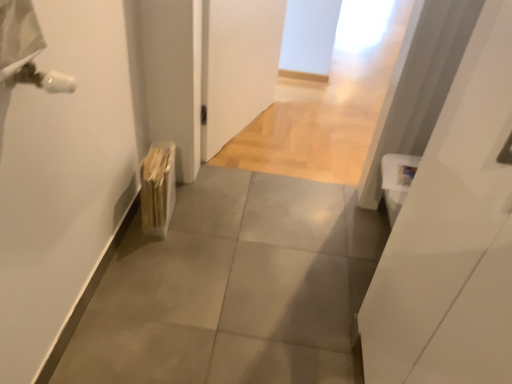
Question: Could you tell me if gray tile floor at center is turned towards wooden radiator at lower left?

Choices:
 (A) no
 (B) yes

Answer: (A)

Question: Does gray tile floor at center have a lesser width compared to wooden radiator at lower left?

Choices:
 (A) yes
 (B) no

Answer: (B)

Question: Considering the relative sizes of gray tile floor at center and wooden radiator at lower left in the image provided, is gray tile floor at center bigger than wooden radiator at lower left?

Choices:
 (A) no
 (B) yes

Answer: (B)

Question: Can you confirm if gray tile floor at center is smaller than wooden radiator at lower left?

Choices:
 (A) yes
 (B) no

Answer: (B)

Question: Can you confirm if gray tile floor at center is shorter than wooden radiator at lower left?

Choices:
 (A) no
 (B) yes

Answer: (B)

Question: Is gray tile floor at center far away from wooden radiator at lower left?

Choices:
 (A) yes
 (B) no

Answer: (B)

Question: Does gray tile floor at center have a smaller size compared to white glossy door at right?

Choices:
 (A) yes
 (B) no

Answer: (B)

Question: Considering the relative sizes of gray tile floor at center and white glossy door at right in the image provided, is gray tile floor at center bigger than white glossy door at right?

Choices:
 (A) no
 (B) yes

Answer: (B)

Question: Does gray tile floor at center appear on the right side of white glossy door at right?

Choices:
 (A) yes
 (B) no

Answer: (B)

Question: Could white glossy door at right be considered to be inside gray tile floor at center?

Choices:
 (A) yes
 (B) no

Answer: (B)

Question: Does gray tile floor at center appear on the left side of white glossy door at right?

Choices:
 (A) no
 (B) yes

Answer: (B)

Question: From the image's perspective, would you say gray tile floor at center is shown under white glossy door at right?

Choices:
 (A) yes
 (B) no

Answer: (A)

Question: Is the depth of white glossy door at right greater than that of wooden radiator at lower left?

Choices:
 (A) yes
 (B) no

Answer: (B)